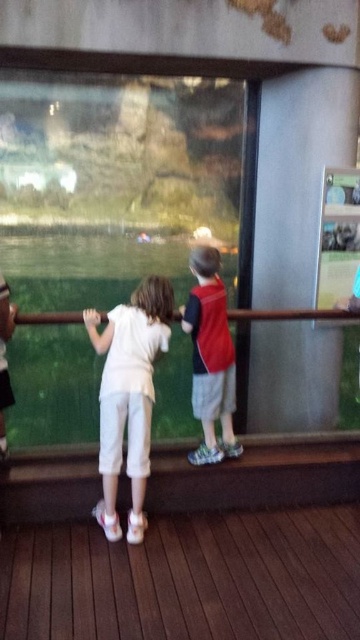
You are a tour guide explaining the layout of the zoo to visitors. You point to two points on the glass window in front of the children. The first point is at coordinates point [110,339] and the second point is at point [218,314]. Which of these two points is closer to the visitors?

Point [110,339] is closer to the viewer than point [218,314].

You are a photographer taking a picture of the two children standing on the wooden platform. You want to ensure that both the white cotton shirt at center and the red fabric backpack at center are clearly visible in the photo. Which child should you focus on to capture both objects in the frame?

You should focus on the child on the left because the white cotton shirt at center is to the left of the red fabric backpack at center, meaning both objects are positioned on the left side of the scene.